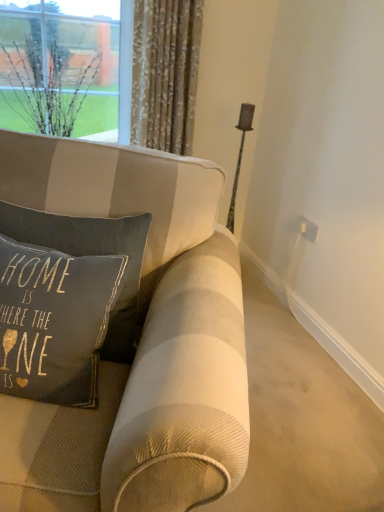
Question: Could you tell me if floral fabric curtain at upper center is turned towards dark gray fabric pillow at center?

Choices:
 (A) no
 (B) yes

Answer: (A)

Question: Considering the relative sizes of floral fabric curtain at upper center and dark gray fabric pillow at center in the image provided, is floral fabric curtain at upper center taller than dark gray fabric pillow at center?

Choices:
 (A) no
 (B) yes

Answer: (B)

Question: Is floral fabric curtain at upper center facing away from dark gray fabric pillow at center?

Choices:
 (A) yes
 (B) no

Answer: (B)

Question: Is floral fabric curtain at upper center surrounding dark gray fabric pillow at center?

Choices:
 (A) yes
 (B) no

Answer: (B)

Question: Are floral fabric curtain at upper center and dark gray fabric pillow at center located far from each other?

Choices:
 (A) yes
 (B) no

Answer: (A)

Question: Is floral fabric curtain at upper center wider or thinner than dark gray fabric pillow at center?

Choices:
 (A) wide
 (B) thin

Answer: (B)

Question: From the image's perspective, is floral fabric curtain at upper center above or below dark gray fabric pillow at center?

Choices:
 (A) below
 (B) above

Answer: (B)

Question: Is point tap(140, 71) closer or farther from the camera than point tap(77, 225)?

Choices:
 (A) farther
 (B) closer

Answer: (A)

Question: From a real-world perspective, is floral fabric curtain at upper center positioned above or below dark gray fabric pillow at center?

Choices:
 (A) below
 (B) above

Answer: (B)

Question: Does point tap(8, 12) appear closer or farther from the camera than point tap(96, 228)?

Choices:
 (A) farther
 (B) closer

Answer: (A)

Question: Based on their sizes in the image, would you say clear glass vase at upper left is bigger or smaller than dark gray fabric pillow at center?

Choices:
 (A) big
 (B) small

Answer: (A)

Question: Is clear glass vase at upper left taller or shorter than dark gray fabric pillow at center?

Choices:
 (A) tall
 (B) short

Answer: (A)

Question: Considering their positions, is clear glass vase at upper left located in front of or behind dark gray fabric pillow at center?

Choices:
 (A) front
 (B) behind

Answer: (B)

Question: Which is correct: clear glass vase at upper left is inside floral fabric curtain at upper center, or outside of it?

Choices:
 (A) outside
 (B) inside

Answer: (A)

Question: From a real-world perspective, is clear glass vase at upper left above or below floral fabric curtain at upper center?

Choices:
 (A) above
 (B) below

Answer: (B)